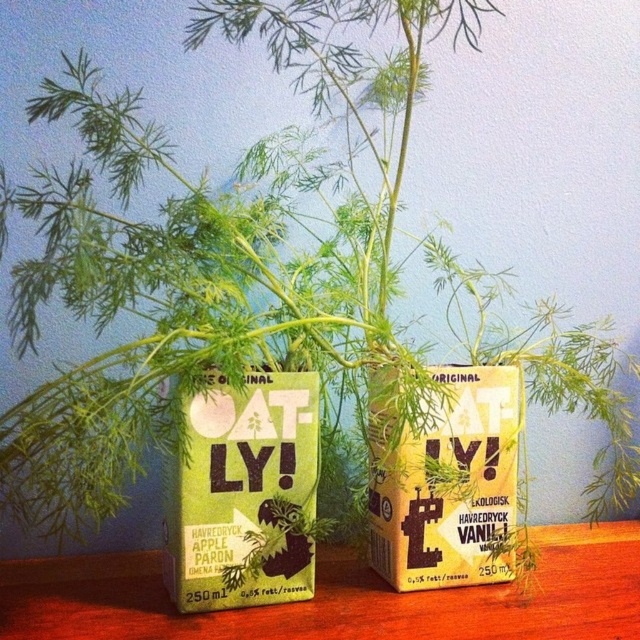
What do you see at coordinates (339, 598) in the screenshot? Image resolution: width=640 pixels, height=640 pixels. I see `wooden table at center` at bounding box center [339, 598].

Is wooden table at center bigger than yellow paper carton at center?

Indeed, wooden table at center has a larger size compared to yellow paper carton at center.

Is point (598, 538) behind point (492, 410)?

Yes.

What are the coordinates of `wooden table at center` in the screenshot? It's located at (339, 598).

Does wooden table at center appear under green matte carton at center?

Correct, wooden table at center is located below green matte carton at center.

Image resolution: width=640 pixels, height=640 pixels. What do you see at coordinates (339, 598) in the screenshot?
I see `wooden table at center` at bounding box center [339, 598].

The width and height of the screenshot is (640, 640). In order to click on wooden table at center in this screenshot , I will do `click(339, 598)`.

Based on the photo, is green matte carton at center taller than yellow paper carton at center?

Incorrect, green matte carton at center's height is not larger of yellow paper carton at center's.

Does point (198, 556) come in front of point (388, 484)?

Yes, point (198, 556) is in front of point (388, 484).

In order to click on green matte carton at center in this screenshot , I will do coord(243,496).